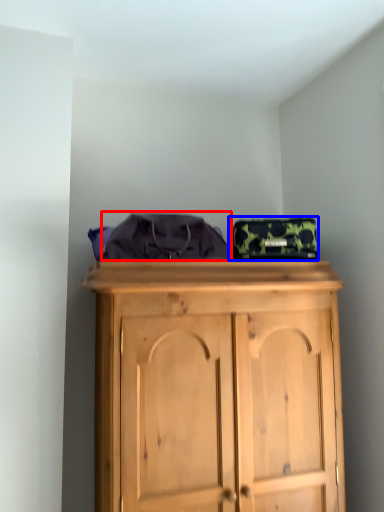
Question: Among these objects, which one is farthest to the camera, clothing (highlighted by a red box) or bag (highlighted by a blue box)?

Choices:
 (A) clothing
 (B) bag

Answer: (B)